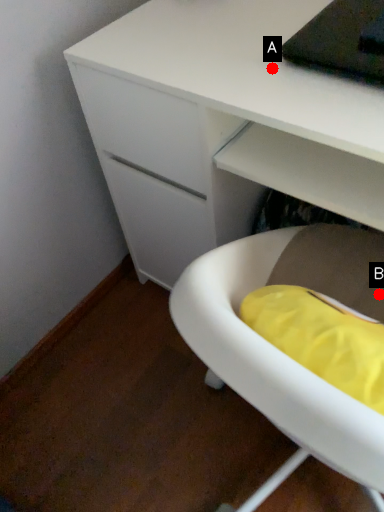
Question: Two points are circled on the image, labeled by A and B beside each circle. Which point appears farthest from the camera in this image?

Choices:
 (A) A is further
 (B) B is further

Answer: (B)